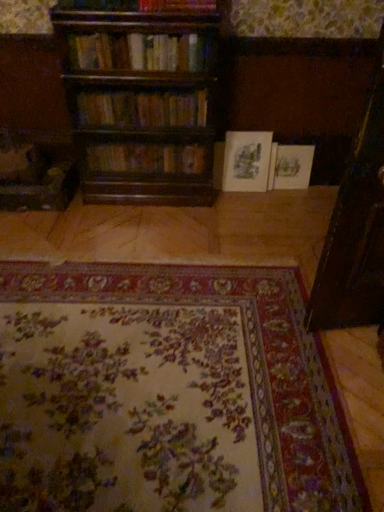
What are the coordinates of `vacant space to the right of matte paper book at center, the fourth book viewed from the front` in the screenshot? It's located at (283, 195).